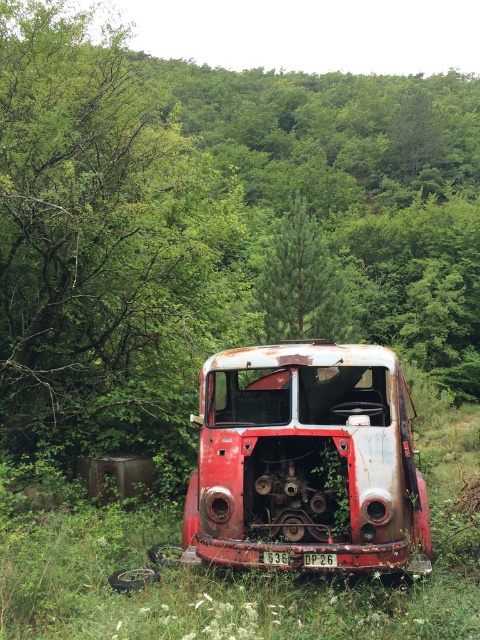
Between rusty metal truck at center and green leafy tree at center, which one appears on the left side from the viewer's perspective?

rusty metal truck at center

Does point (297, 368) come in front of point (322, 241)?

That is True.

The width and height of the screenshot is (480, 640). What do you see at coordinates (305, 461) in the screenshot?
I see `rusty metal truck at center` at bounding box center [305, 461].

The height and width of the screenshot is (640, 480). In order to click on rusty metal truck at center in this screenshot , I will do `click(305, 461)`.

In the scene shown: Between green grass at center and green leafy tree at center, which one has less height?

green grass at center

Between green grass at center and green leafy tree at center, which one appears on the right side from the viewer's perspective?

Positioned to the right is green grass at center.

The height and width of the screenshot is (640, 480). Describe the element at coordinates (241, 572) in the screenshot. I see `green grass at center` at that location.

Where is `green grass at center`? Image resolution: width=480 pixels, height=640 pixels. green grass at center is located at coordinates (241, 572).

Measure the distance between point (x=468, y=186) and camera.

Point (x=468, y=186) and camera are 119.06 meters apart.

Is green leafy forest at center taller than green grass at center?

Correct, green leafy forest at center is much taller as green grass at center.

Find the location of a particular element. green leafy forest at center is located at coordinates (214, 227).